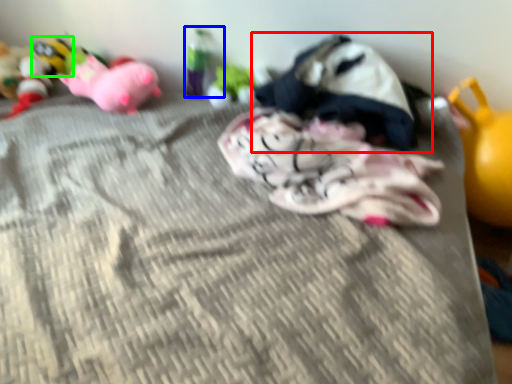
Question: Estimate the real-world distances between objects in this image. Which object is closer to toy (highlighted by a red box), toy (highlighted by a blue box) or toy (highlighted by a green box)?

Choices:
 (A) toy
 (B) toy

Answer: (A)